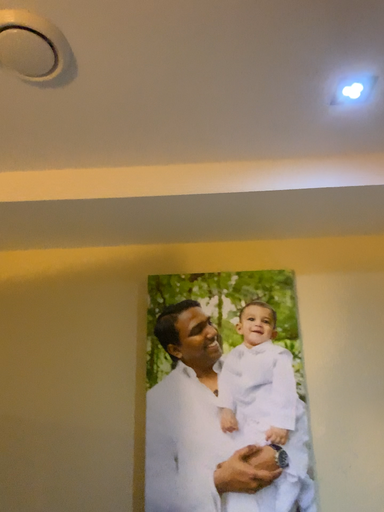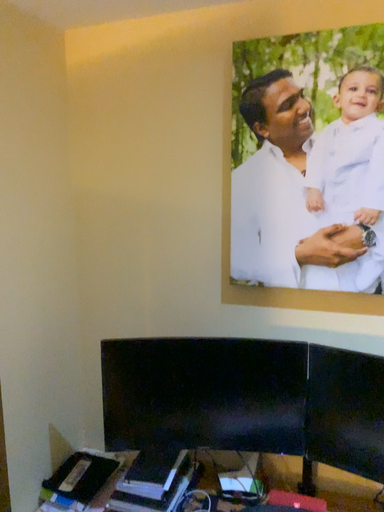
Question: Which way did the camera rotate in the video?

Choices:
 (A) rotated right
 (B) rotated left

Answer: (B)